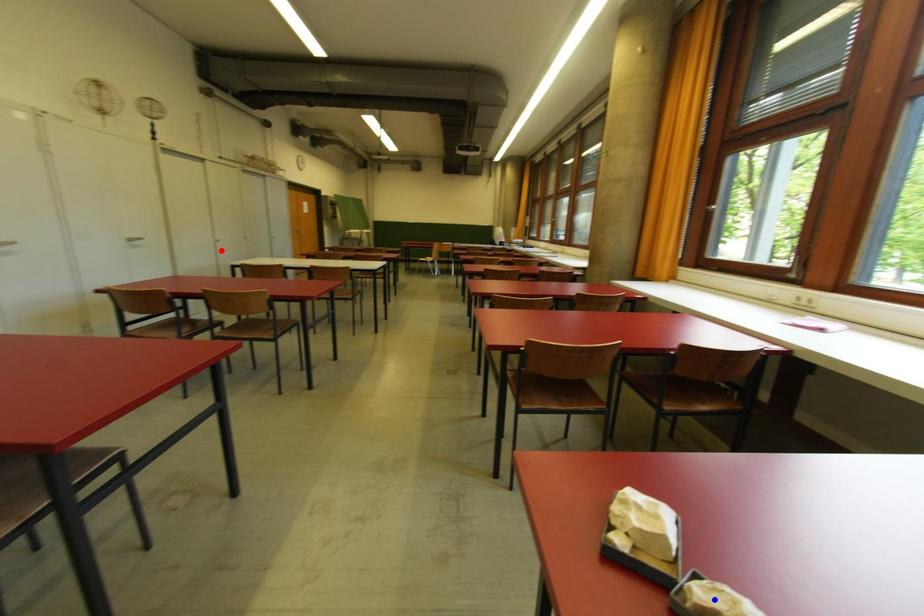
Question: Two points are marked on the image. Which point is closer to the camera?

Choices:
 (A) Blue point is closer.
 (B) Red point is closer.

Answer: (A)